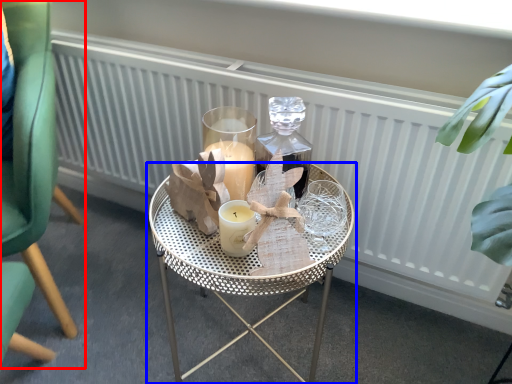
Question: Among these objects, which one is nearest to the camera, chair (highlighted by a red box) or table (highlighted by a blue box)?

Choices:
 (A) chair
 (B) table

Answer: (A)